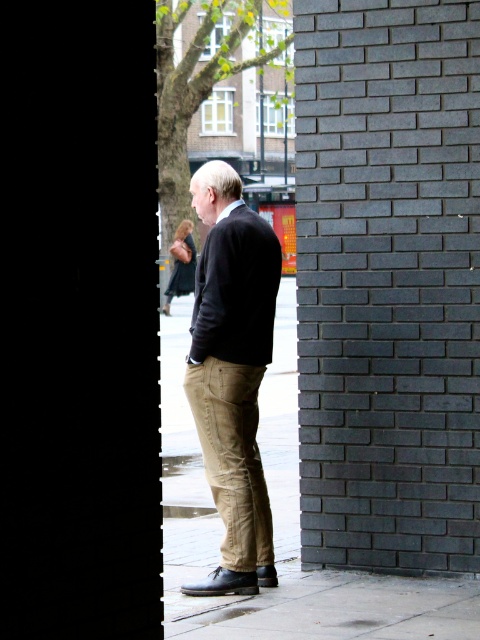
Locate an element on the screen. dark brown leather shoes at center is located at coordinates (232, 372).

Can you confirm if dark brown leather shoes at center is shorter than khaki cotton pants at center?

No.

This screenshot has width=480, height=640. Describe the element at coordinates (232, 372) in the screenshot. I see `dark brown leather shoes at center` at that location.

Image resolution: width=480 pixels, height=640 pixels. I want to click on dark brown leather shoes at center, so click(232, 372).

What do you see at coordinates (387, 284) in the screenshot?
I see `dark gray brick wall at right` at bounding box center [387, 284].

This screenshot has height=640, width=480. In order to click on dark gray brick wall at right in this screenshot , I will do `click(387, 284)`.

Does point (404, 352) lie in front of point (240, 509)?

No, (404, 352) is further to viewer.

Locate an element on the screen. dark gray brick wall at right is located at coordinates (387, 284).

Does dark gray brick wall at right have a smaller size compared to dark brown leather shoes at center?

Actually, dark gray brick wall at right might be larger than dark brown leather shoes at center.

At what (x,y) coordinates should I click in order to perform the action: click on dark gray brick wall at right. Please return your answer as a coordinate pair (x, y). Looking at the image, I should click on (387, 284).

This screenshot has height=640, width=480. Find the location of `dark gray brick wall at right`. dark gray brick wall at right is located at coordinates (x=387, y=284).